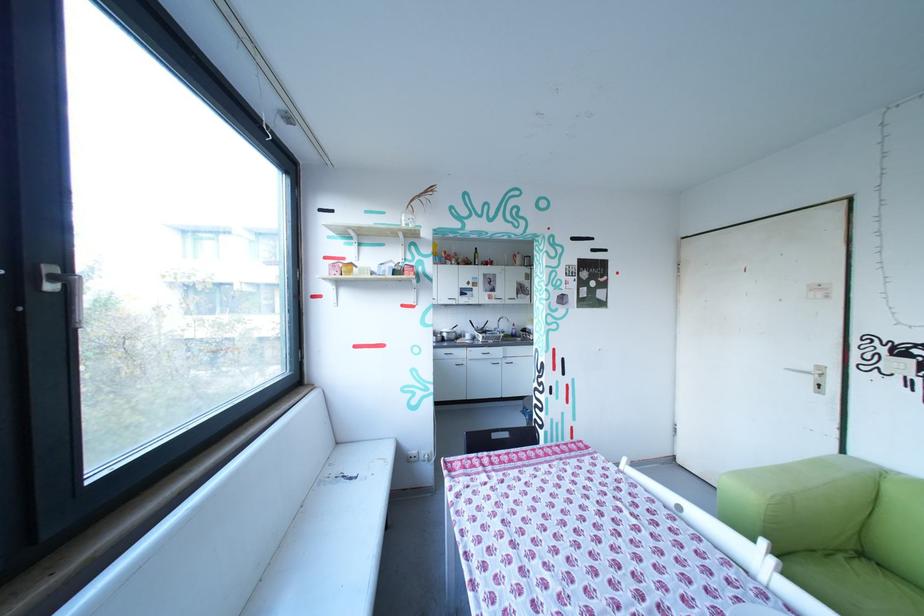
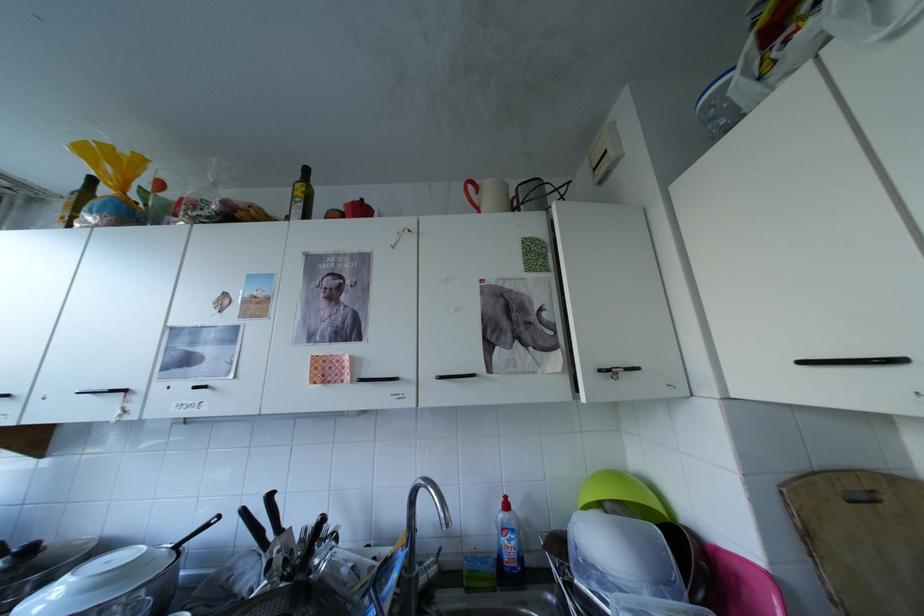
Question: In a continuous first-person perspective shot, in which direction is the camera moving?

Choices:
 (A) Left
 (B) Right
 (C) Forward
 (D) Backward

Answer: (C)